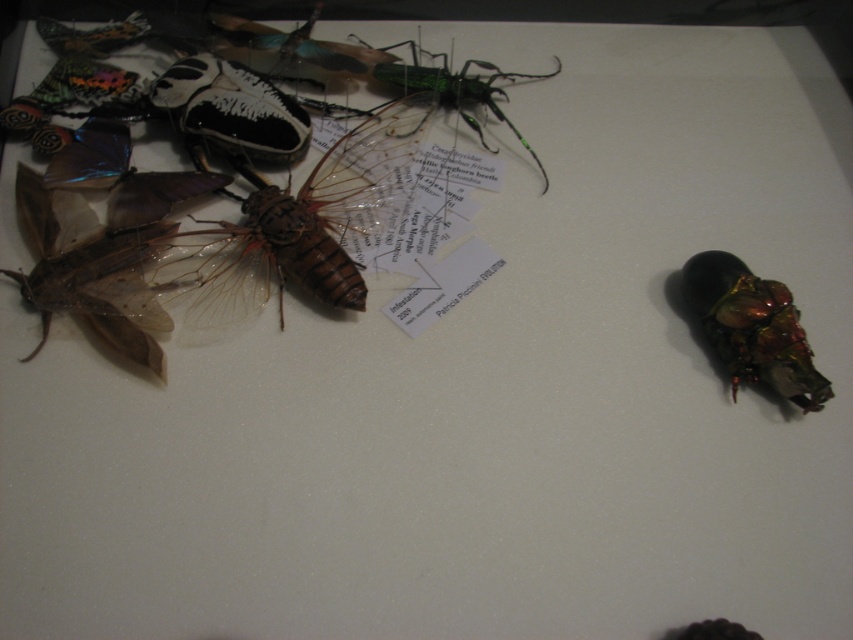
You are an entomologist examining the preserved insects. You need to reach the metallic iridescent beetle at right first before the brown translucent wing at center. Which one should you move first to access the other?

You should move the brown translucent wing at center first because it is closer to you than the metallic iridescent beetle at right, so moving it allows access to the beetle behind it.